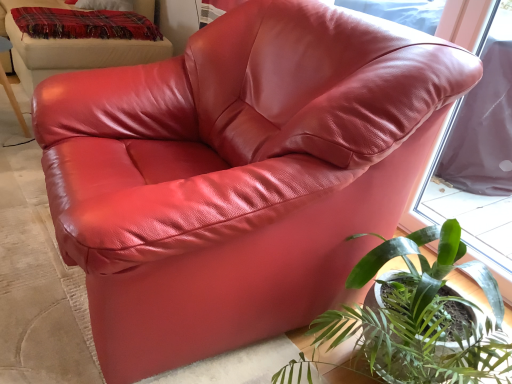
Find the location of a particular element. satin red bean bag at upper right is located at coordinates (72, 50).

Are green leafy plant at lower right and satin red bean bag at upper right far apart?

That's right, there is a large distance between green leafy plant at lower right and satin red bean bag at upper right.

Does green leafy plant at lower right have a lesser height compared to satin red bean bag at upper right?

Yes.

Considering the positions of objects green leafy plant at lower right and satin red bean bag at upper right in the image provided, who is in front, green leafy plant at lower right or satin red bean bag at upper right?

green leafy plant at lower right is in front.

Which of these two, green leafy plant at lower right or satin red bean bag at upper right, is wider?

Wider between the two is satin red bean bag at upper right.

Is satin red bean bag at upper right bigger than green leafy plant at lower right?

Indeed, satin red bean bag at upper right has a larger size compared to green leafy plant at lower right.

Is satin red bean bag at upper right positioned with its back to green leafy plant at lower right?

No, satin red bean bag at upper right is not facing the opposite direction of green leafy plant at lower right.

Between satin red bean bag at upper right and green leafy plant at lower right, which one has less height?

Standing shorter between the two is green leafy plant at lower right.

Are satin red bean bag at upper right and green leafy plant at lower right beside each other?

satin red bean bag at upper right is not next to green leafy plant at lower right, and they're not touching.

Is the depth of plaid woolen blanket at upper left greater than that of satin red bean bag at upper right?

That is True.

Considering the positions of point (111, 35) and point (15, 44), is point (111, 35) closer or farther from the camera than point (15, 44)?

Point (111, 35) is closer to the camera than point (15, 44).

How much distance is there between plaid woolen blanket at upper left and satin red bean bag at upper right?

4.66 inches.

Is plaid woolen blanket at upper left wider or thinner than satin red bean bag at upper right?

plaid woolen blanket at upper left is thinner than satin red bean bag at upper right.

Looking at the image, does satin red bean bag at upper right seem bigger or smaller compared to plaid woolen blanket at upper left?

satin red bean bag at upper right is bigger than plaid woolen blanket at upper left.

Considering the relative positions of satin red bean bag at upper right and plaid woolen blanket at upper left in the image provided, is satin red bean bag at upper right to the left or to the right of plaid woolen blanket at upper left?

satin red bean bag at upper right is to the left of plaid woolen blanket at upper left.

Is there a large distance between satin red bean bag at upper right and plaid woolen blanket at upper left?

That's not correct — satin red bean bag at upper right is a little close to plaid woolen blanket at upper left.

Looking at their sizes, would you say satin red bean bag at upper right is wider or thinner than plaid woolen blanket at upper left?

Considering their sizes, satin red bean bag at upper right looks broader than plaid woolen blanket at upper left.

How far apart are green leafy plant at lower right and plaid woolen blanket at upper left?

green leafy plant at lower right and plaid woolen blanket at upper left are 6.79 feet apart.

From the image's perspective, is green leafy plant at lower right on plaid woolen blanket at upper left?

Actually, green leafy plant at lower right appears below plaid woolen blanket at upper left in the image.

Which object is thinner, green leafy plant at lower right or plaid woolen blanket at upper left?

green leafy plant at lower right.

In the image, is green leafy plant at lower right positioned in front of or behind plaid woolen blanket at upper left?

Visually, green leafy plant at lower right is located in front of plaid woolen blanket at upper left.

Considering the relative sizes of plaid woolen blanket at upper left and green leafy plant at lower right in the image provided, is plaid woolen blanket at upper left thinner than green leafy plant at lower right?

Incorrect, the width of plaid woolen blanket at upper left is not less than that of green leafy plant at lower right.

Is green leafy plant at lower right surrounded by plaid woolen blanket at upper left?

No, green leafy plant at lower right is located outside of plaid woolen blanket at upper left.

In the image, is plaid woolen blanket at upper left positioned in front of or behind green leafy plant at lower right?

Visually, plaid woolen blanket at upper left is located behind green leafy plant at lower right.

Where is `bean bag chair above the green leafy plant at lower right (from a real-world perspective)`? bean bag chair above the green leafy plant at lower right (from a real-world perspective) is located at coordinates (72, 50).

The image size is (512, 384). Find the location of `bean bag chair lying on the left of green leafy plant at lower right`. bean bag chair lying on the left of green leafy plant at lower right is located at coordinates (72, 50).

Based on their spatial positions, is satin red bean bag at upper right or plaid woolen blanket at upper left closer to green leafy plant at lower right?

satin red bean bag at upper right lies closer to green leafy plant at lower right than the other object.

Based on their spatial positions, is plaid woolen blanket at upper left or satin red bean bag at upper right further from green leafy plant at lower right?

plaid woolen blanket at upper left.

Looking at the image, which one is located further to satin red bean bag at upper right, green leafy plant at lower right or plaid woolen blanket at upper left?

green leafy plant at lower right is positioned further to the anchor satin red bean bag at upper right.

From the image, which object appears to be farther from plaid woolen blanket at upper left, satin red bean bag at upper right or green leafy plant at lower right?

The object further to plaid woolen blanket at upper left is green leafy plant at lower right.

Looking at the image, which one is located closer to plaid woolen blanket at upper left, green leafy plant at lower right or satin red bean bag at upper right?

The object closer to plaid woolen blanket at upper left is satin red bean bag at upper right.

Based on their spatial positions, is plaid woolen blanket at upper left or green leafy plant at lower right further from satin red bean bag at upper right?

green leafy plant at lower right is positioned further to the anchor satin red bean bag at upper right.

Locate an element on the screen. This screenshot has height=384, width=512. blanket that lies between satin red bean bag at upper right and green leafy plant at lower right from top to bottom is located at coordinates (84, 24).